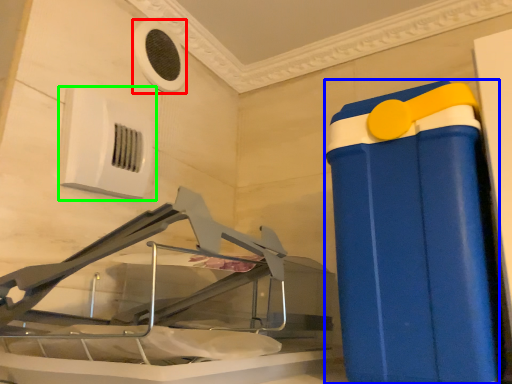
Question: Considering the real-world distances, which object is farthest from air conditioning (highlighted by a red box)? waste container (highlighted by a blue box) or air conditioning (highlighted by a green box)?

Choices:
 (A) waste container
 (B) air conditioning

Answer: (A)